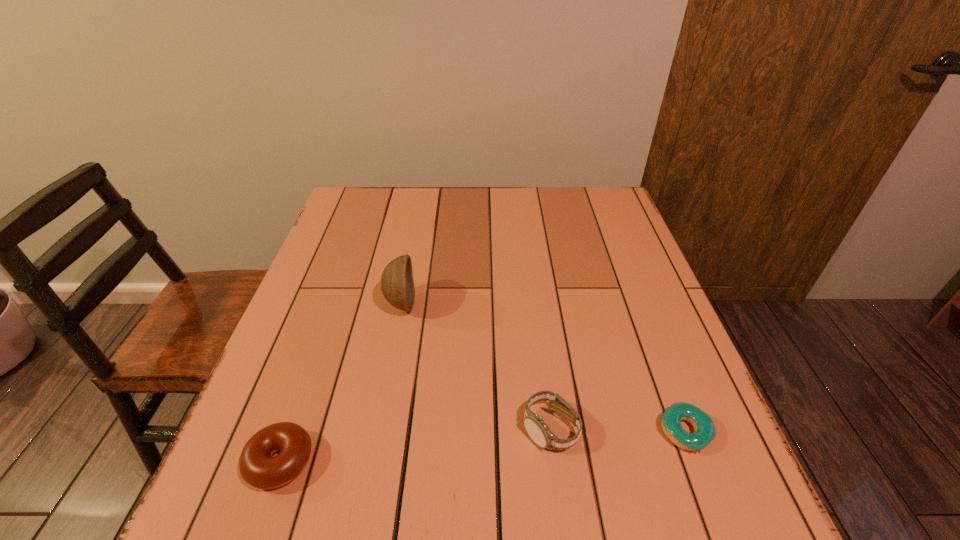
This screenshot has height=540, width=960. I want to click on the tallest object, so [397, 285].

You are a GUI agent. You are given a task and a screenshot of the screen. Output one action in this format:
    pyautogui.click(x=<x>, y=<y>)
    Task: Click on the third object from right to left
    
    Given the screenshot: What is the action you would take?
    pyautogui.click(x=397, y=285)

You are a GUI agent. You are given a task and a screenshot of the screen. Output one action in this format:
    pyautogui.click(x=<x>, y=<y>)
    Task: Click on the second object from right to left
    Image resolution: width=960 pixels, height=540 pixels.
    Given the screenshot: What is the action you would take?
    pyautogui.click(x=534, y=424)

Where is `watch`? This screenshot has height=540, width=960. watch is located at coordinates (534, 424).

The width and height of the screenshot is (960, 540). What are the coordinates of `the third tallest object` in the screenshot? It's located at (258, 468).

The height and width of the screenshot is (540, 960). In order to click on the leftmost object in this screenshot , I will do `click(258, 468)`.

Find the location of `the right doughnut`. the right doughnut is located at coordinates (705, 432).

At what (x,y) coordinates should I click in order to perform the action: click on the shorter doughnut. Please return your answer as a coordinate pair (x, y). This screenshot has height=540, width=960. Looking at the image, I should click on (705, 432).

This screenshot has width=960, height=540. In order to click on free region located 0.130m on the right of the second object from left to right in this screenshot , I will do `click(468, 303)`.

Identify the location of vacant region located on the face of the second object from right to left. The image size is (960, 540). (557, 483).